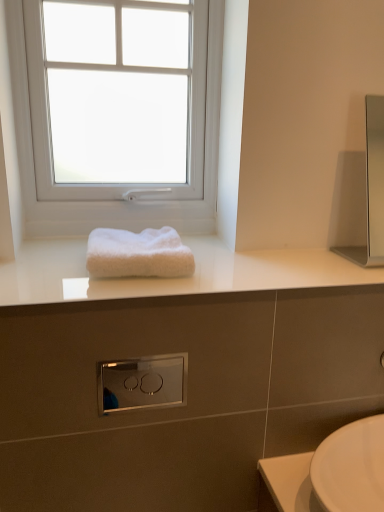
Question: Are satin silver medicine cabinet at right and satin chrome switch at center located far from each other?

Choices:
 (A) no
 (B) yes

Answer: (B)

Question: From a real-world perspective, is satin silver medicine cabinet at right beneath satin chrome switch at center?

Choices:
 (A) no
 (B) yes

Answer: (A)

Question: Can you confirm if satin silver medicine cabinet at right is taller than satin chrome switch at center?

Choices:
 (A) no
 (B) yes

Answer: (B)

Question: Can you confirm if satin silver medicine cabinet at right is bigger than satin chrome switch at center?

Choices:
 (A) no
 (B) yes

Answer: (B)

Question: Is satin silver medicine cabinet at right at the left side of satin chrome switch at center?

Choices:
 (A) no
 (B) yes

Answer: (A)

Question: Is white plastic window at upper center in front of or behind satin chrome switch at center in the image?

Choices:
 (A) behind
 (B) front

Answer: (A)

Question: In terms of width, does white plastic window at upper center look wider or thinner when compared to satin chrome switch at center?

Choices:
 (A) thin
 (B) wide

Answer: (B)

Question: Is white plastic window at upper center situated inside satin chrome switch at center or outside?

Choices:
 (A) inside
 (B) outside

Answer: (B)

Question: Does point pyautogui.click(x=76, y=204) appear closer or farther from the camera than point pyautogui.click(x=100, y=375)?

Choices:
 (A) closer
 (B) farther

Answer: (B)

Question: Is white fluffy towel at center inside or outside of satin silver medicine cabinet at right?

Choices:
 (A) inside
 (B) outside

Answer: (B)

Question: Considering the positions of point (140, 238) and point (355, 252), is point (140, 238) closer or farther from the camera than point (355, 252)?

Choices:
 (A) farther
 (B) closer

Answer: (B)

Question: Considering their positions, is white fluffy towel at center located in front of or behind satin silver medicine cabinet at right?

Choices:
 (A) behind
 (B) front

Answer: (B)

Question: Looking at their shapes, would you say white fluffy towel at center is wider or thinner than satin silver medicine cabinet at right?

Choices:
 (A) thin
 (B) wide

Answer: (B)

Question: From the image's perspective, is satin chrome switch at center above or below satin silver medicine cabinet at right?

Choices:
 (A) above
 (B) below

Answer: (B)

Question: Relative to satin silver medicine cabinet at right, is satin chrome switch at center in front or behind?

Choices:
 (A) behind
 (B) front

Answer: (B)